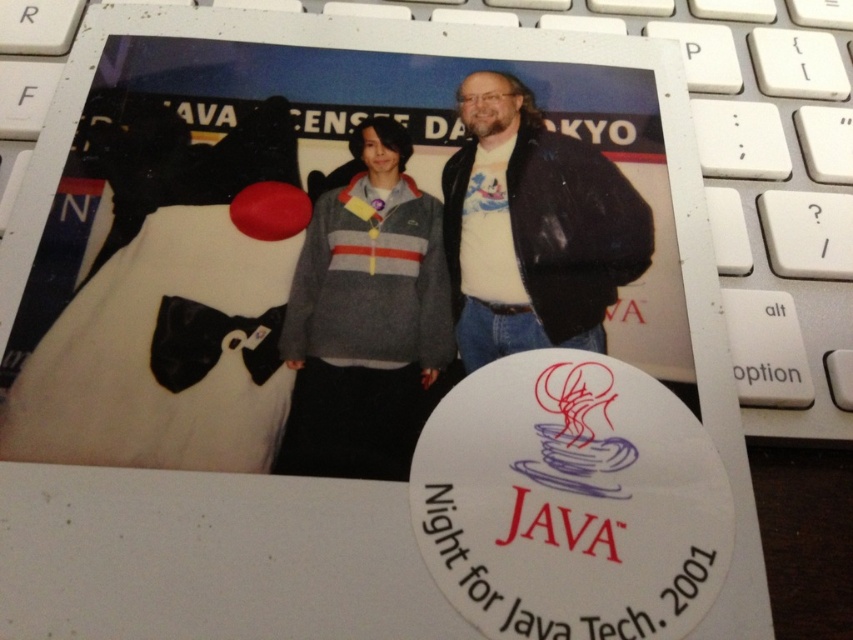
Question: Is white plastic laptop keyboard at center bigger than matte black jacket at center?

Choices:
 (A) no
 (B) yes

Answer: (B)

Question: Can you confirm if gray fleece jacket at center is positioned to the left of matte black jacket at center?

Choices:
 (A) yes
 (B) no

Answer: (A)

Question: Can you confirm if gray fleece jacket at center is thinner than white plastic laptop keyboard at center?

Choices:
 (A) no
 (B) yes

Answer: (B)

Question: Which object is the farthest from the gray fleece sweater at center?

Choices:
 (A) matte black jacket at center
 (B) gray fleece jacket at center

Answer: (A)

Question: Which of the following is the farthest from the observer?

Choices:
 (A) (399, 403)
 (B) (349, 262)

Answer: (B)

Question: Which point is closer to the camera?

Choices:
 (A) (544, 284)
 (B) (335, 273)

Answer: (B)